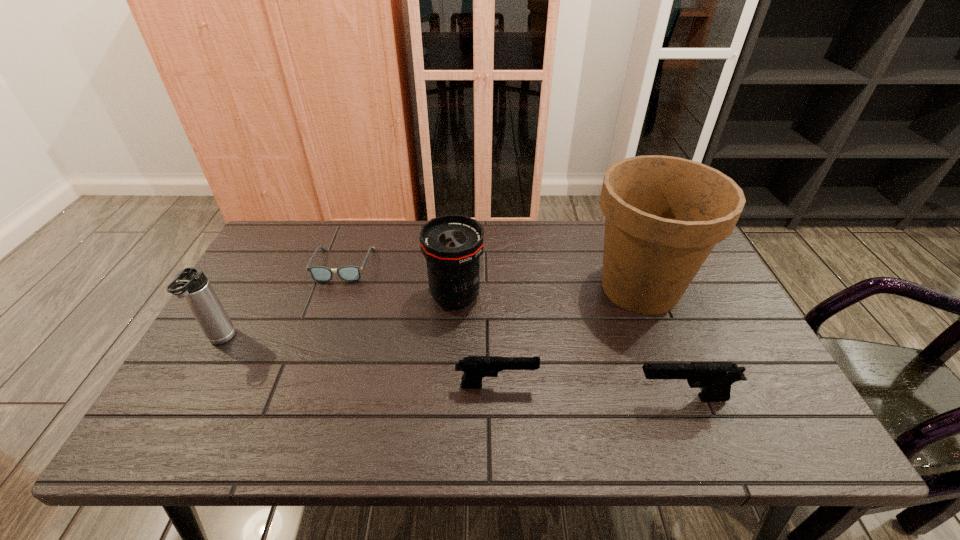
Point out which object is positioned as the nearest to the spectacles. Please provide its 2D coordinates. Your answer should be formatted as a tuple, i.e. [(x, y)], where the tuple contains the x and y coordinates of a point satisfying the conditions above.

[(452, 244)]

At what (x,y) coordinates should I click in order to perform the action: click on free space that satisfies the following two spatial constraints: 1. on the face of the shortest object; 2. on the right side of the tallest object. Please return your answer as a coordinate pair (x, y). Looking at the image, I should click on (335, 288).